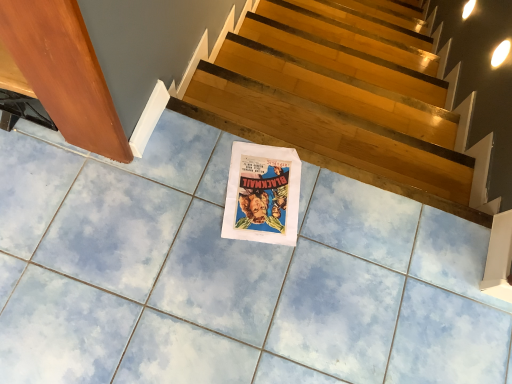
Locate an element on the screen. This screenshot has height=384, width=512. free region under white paper at center (from a real-world perspective) is located at coordinates (263, 195).